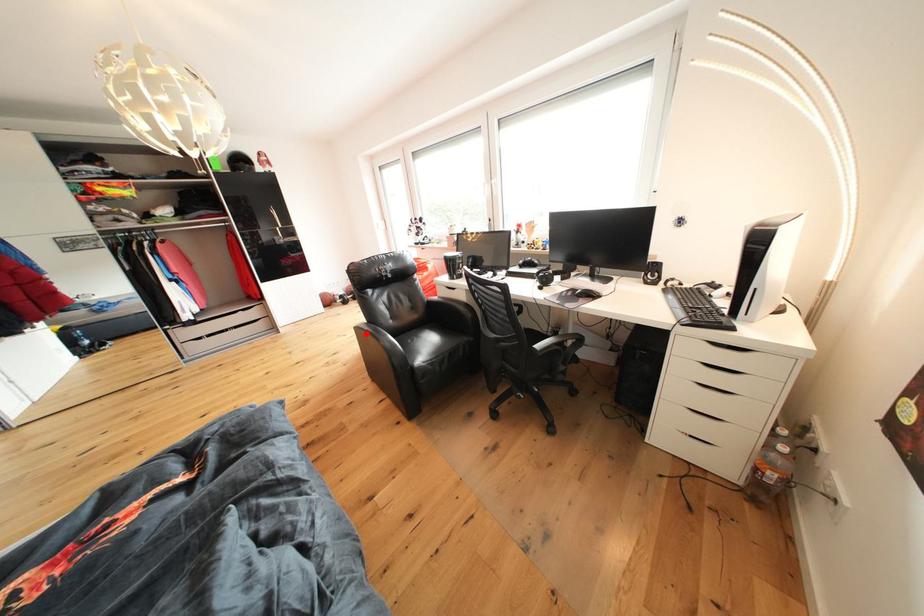
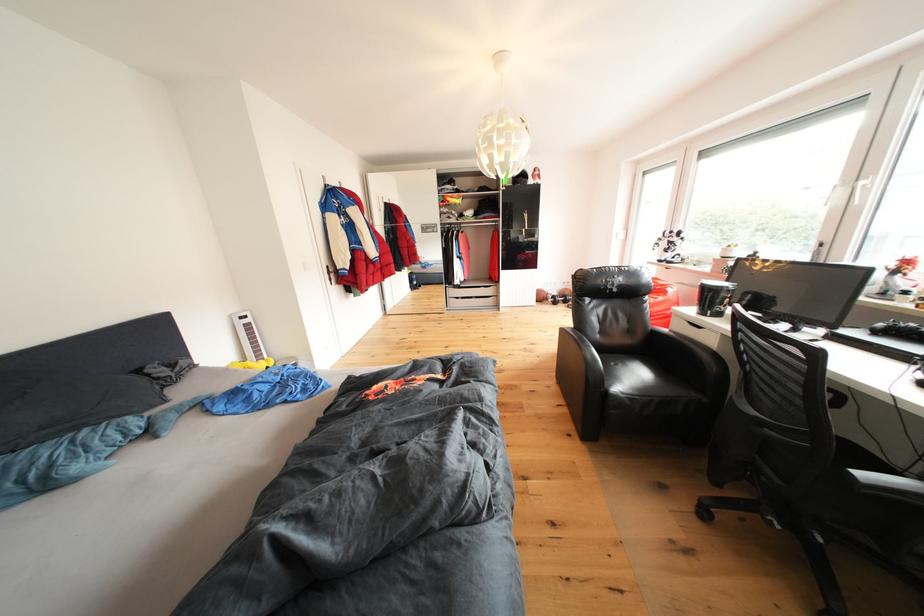
The point at the highlighted location is marked in the first image. Where is the corresponding point in the second image?

(572, 334)